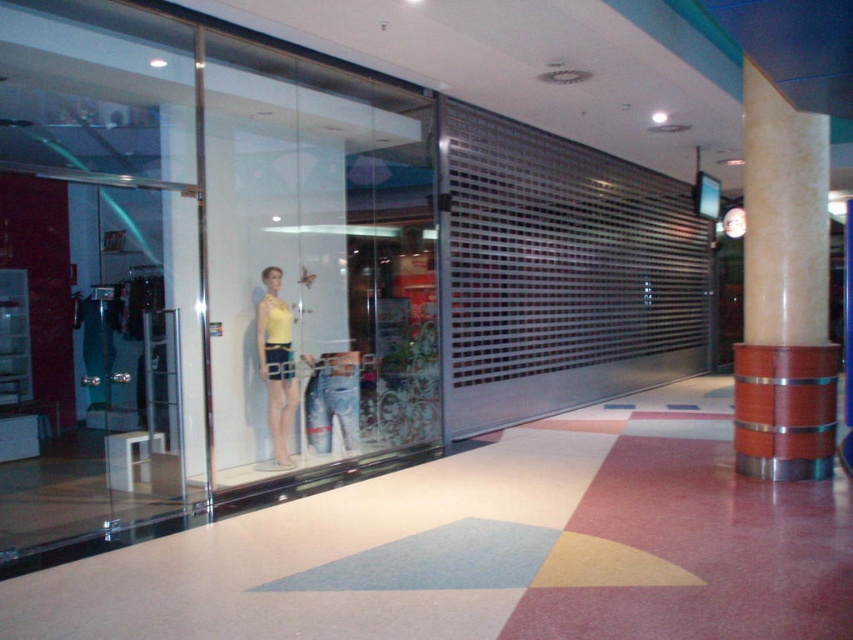
You are standing in the shopping mall and want to know how far the point at coordinates (239, 152) is from your current position. Can you determine the distance?

The point at coordinates (239, 152) is 6.51 meters away from your current position.

You are standing in the shopping mall and want to locate the wooden column at right. Which direction should you look to find the point at coordinates (784, 292)?

The point at coordinates (784, 292) is located on the wooden column at right, so you should look towards the right side of the frame to find it.